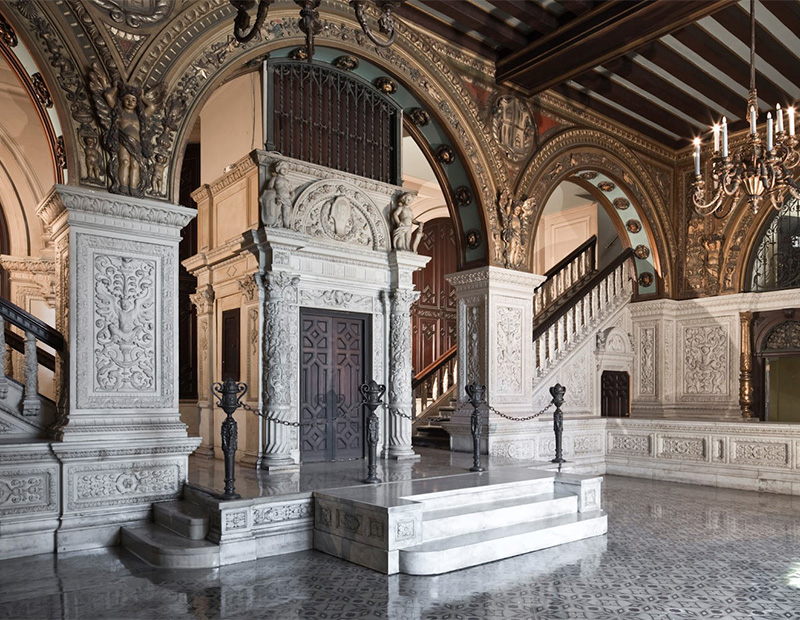
The height and width of the screenshot is (620, 800). What are the coordinates of `angel sculpture` in the screenshot? It's located at (126, 102), (516, 224).